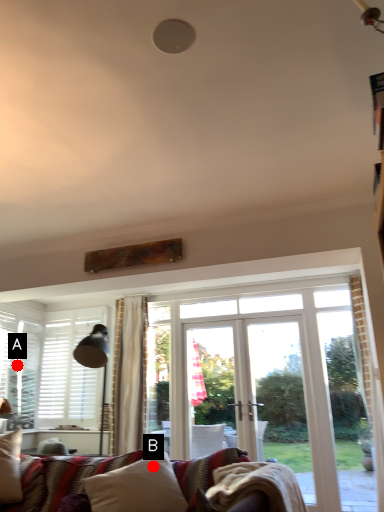
Question: Two points are circled on the image, labeled by A and B beside each circle. Which point appears farthest from the camera in this image?

Choices:
 (A) A is further
 (B) B is further

Answer: (A)